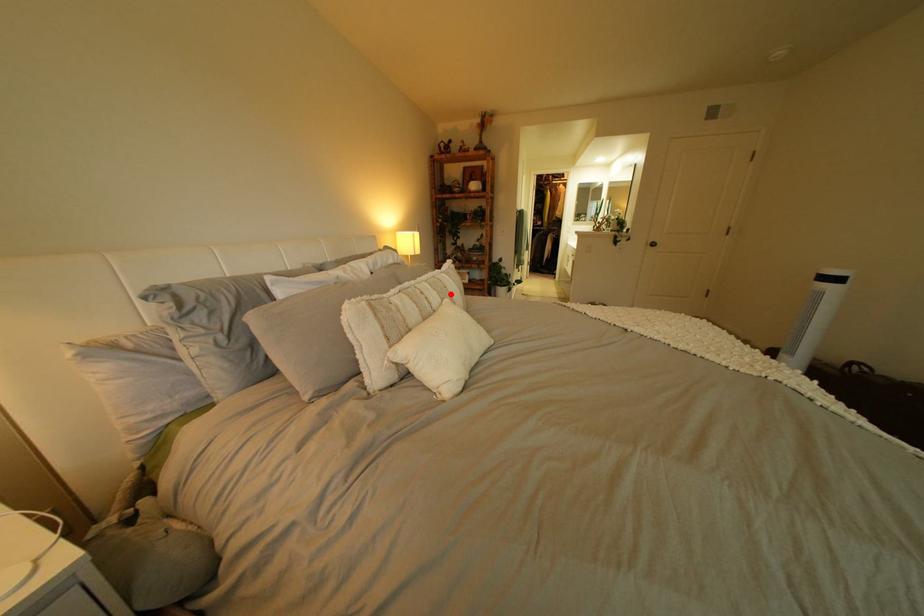
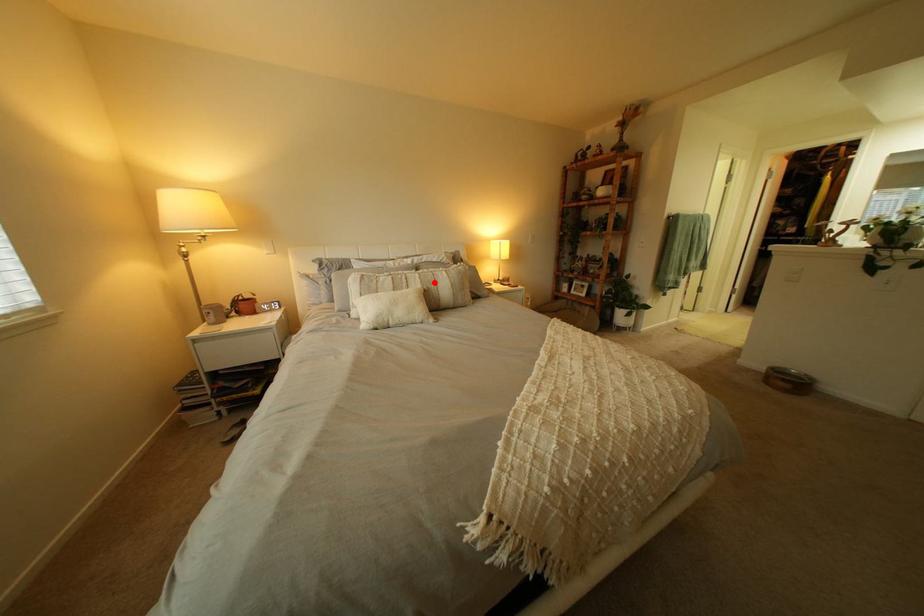
I am providing you with two images of the same scene from different viewpoints. A red point is marked on the first image and another point is marked on the second image. Does the point marked in image1 correspond to the same location as the one in image2?

Yes